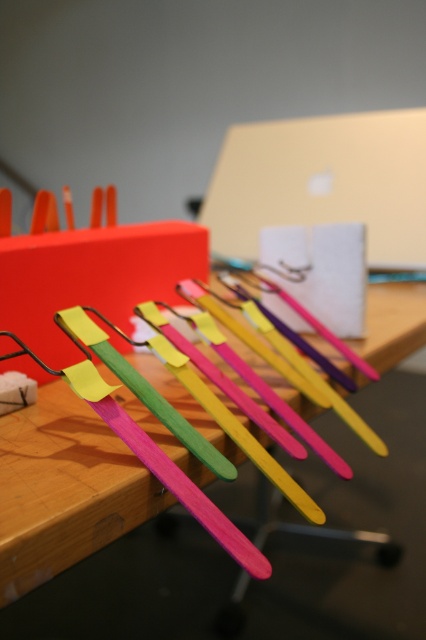
Who is positioned more to the right, wooden table at center or metallic gold laptop at center?

metallic gold laptop at center is more to the right.

Where is `wooden table at center`? This screenshot has height=640, width=426. wooden table at center is located at coordinates (65, 488).

Identify the location of wooden table at center. The height and width of the screenshot is (640, 426). (65, 488).